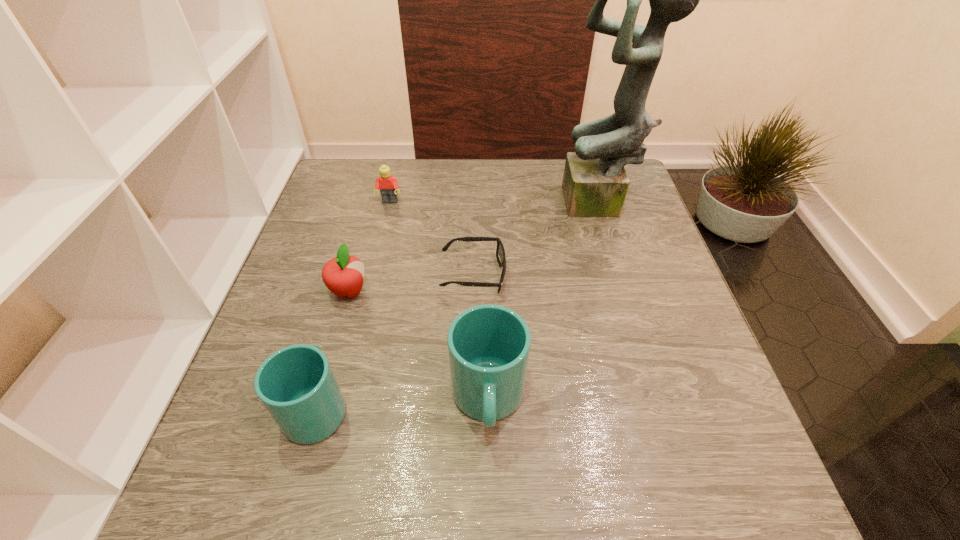
Identify the location of object that is the third closest to the taller cup. (343, 275).